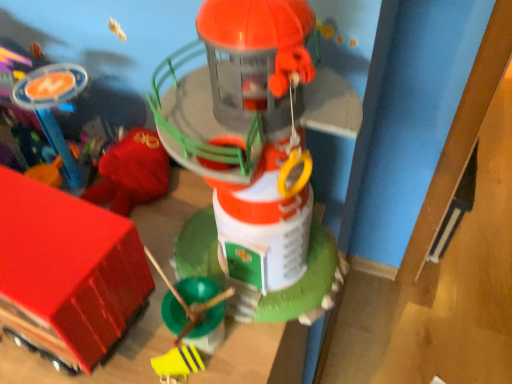
Question: From a real-world perspective, is smooth plastic toy at center, which is the 1th toy from right to left, on rubberized red truck at lower left, arranged as the first toy when viewed from the left?

Choices:
 (A) no
 (B) yes

Answer: (B)

Question: Is smooth plastic toy at center, which is the 1th toy from right to left, bigger than rubberized red truck at lower left, arranged as the third toy when viewed from the right?

Choices:
 (A) yes
 (B) no

Answer: (A)

Question: Is smooth plastic toy at center, the third toy viewed from the left, taller than rubberized red truck at lower left, arranged as the third toy when viewed from the right?

Choices:
 (A) yes
 (B) no

Answer: (A)

Question: Is smooth plastic toy at center, the third toy viewed from the left, closer to camera compared to rubberized red truck at lower left, arranged as the third toy when viewed from the right?

Choices:
 (A) yes
 (B) no

Answer: (A)

Question: From a real-world perspective, is smooth plastic toy at center, the third toy viewed from the left, physically below rubberized red truck at lower left, arranged as the third toy when viewed from the right?

Choices:
 (A) no
 (B) yes

Answer: (A)

Question: Is smooth plastic toy at center, which is the 1th toy from right to left, next to rubberized red truck at lower left, arranged as the first toy when viewed from the left?

Choices:
 (A) yes
 (B) no

Answer: (B)

Question: From a real-world perspective, is yellow matte toy at lower center, the second toy positioned from the right, beneath rubberized red truck at lower left, arranged as the third toy when viewed from the right?

Choices:
 (A) no
 (B) yes

Answer: (B)

Question: Is yellow matte toy at lower center, marked as the second toy in a left-to-right arrangement, positioned with its back to rubberized red truck at lower left, arranged as the first toy when viewed from the left?

Choices:
 (A) no
 (B) yes

Answer: (A)

Question: From the image's perspective, would you say yellow matte toy at lower center, the second toy positioned from the right, is shown under rubberized red truck at lower left, arranged as the third toy when viewed from the right?

Choices:
 (A) yes
 (B) no

Answer: (A)

Question: Is yellow matte toy at lower center, marked as the second toy in a left-to-right arrangement, shorter than rubberized red truck at lower left, arranged as the first toy when viewed from the left?

Choices:
 (A) yes
 (B) no

Answer: (A)

Question: From a real-world perspective, is yellow matte toy at lower center, the second toy positioned from the right, physically above rubberized red truck at lower left, arranged as the third toy when viewed from the right?

Choices:
 (A) yes
 (B) no

Answer: (B)

Question: Considering the relative positions of yellow matte toy at lower center, marked as the second toy in a left-to-right arrangement, and rubberized red truck at lower left, arranged as the first toy when viewed from the left, in the image provided, is yellow matte toy at lower center, marked as the second toy in a left-to-right arrangement, behind rubberized red truck at lower left, arranged as the first toy when viewed from the left,?

Choices:
 (A) no
 (B) yes

Answer: (B)

Question: Can you confirm if smooth plastic toy at center, which is the 1th toy from right to left, is positioned to the right of yellow matte toy at lower center, the second toy positioned from the right?

Choices:
 (A) yes
 (B) no

Answer: (A)